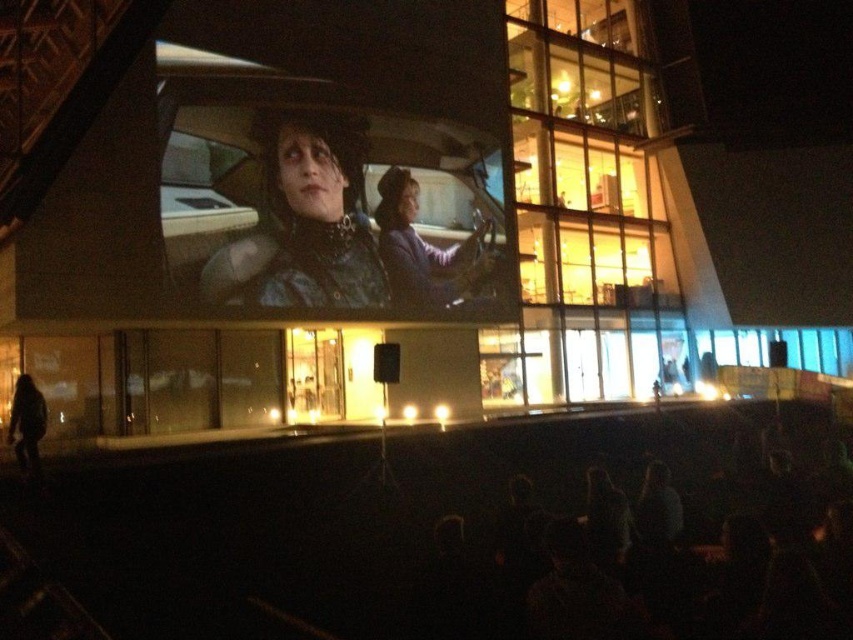
Who is lower down, matte black leather car at center or purple fabric jacket at center?

purple fabric jacket at center is lower down.

Which is more to the left, matte black leather car at center or purple fabric jacket at center?

matte black leather car at center is more to the left.

What do you see at coordinates (323, 196) in the screenshot? I see `matte black leather car at center` at bounding box center [323, 196].

I want to click on matte black leather car at center, so click(x=323, y=196).

The width and height of the screenshot is (853, 640). Find the location of `leather jacket at center`. leather jacket at center is located at coordinates (303, 224).

Does leather jacket at center have a smaller size compared to dark textured coat at lower left?

No.

This screenshot has height=640, width=853. What do you see at coordinates (303, 224) in the screenshot?
I see `leather jacket at center` at bounding box center [303, 224].

Identify the location of leather jacket at center. This screenshot has width=853, height=640. (303, 224).

You are a GUI agent. You are given a task and a screenshot of the screen. Output one action in this format:
    pyautogui.click(x=<x>, y=<y>)
    Task: Click on the leather jacket at center
    Image resolution: width=853 pixels, height=640 pixels.
    Given the screenshot: What is the action you would take?
    pyautogui.click(x=303, y=224)

Identify the location of leather jacket at center. (303, 224).